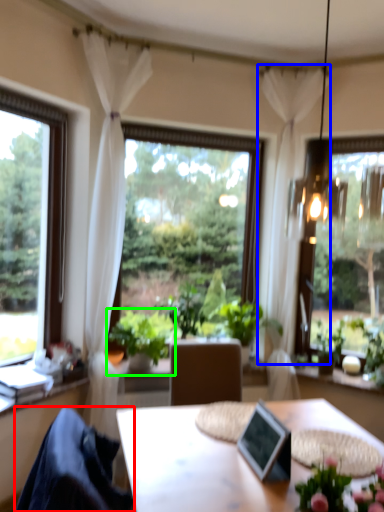
Question: Considering the real-world distances, which object is closest to chair (highlighted by a red box)? curtain (highlighted by a blue box) or houseplant (highlighted by a green box).

Choices:
 (A) curtain
 (B) houseplant

Answer: (B)